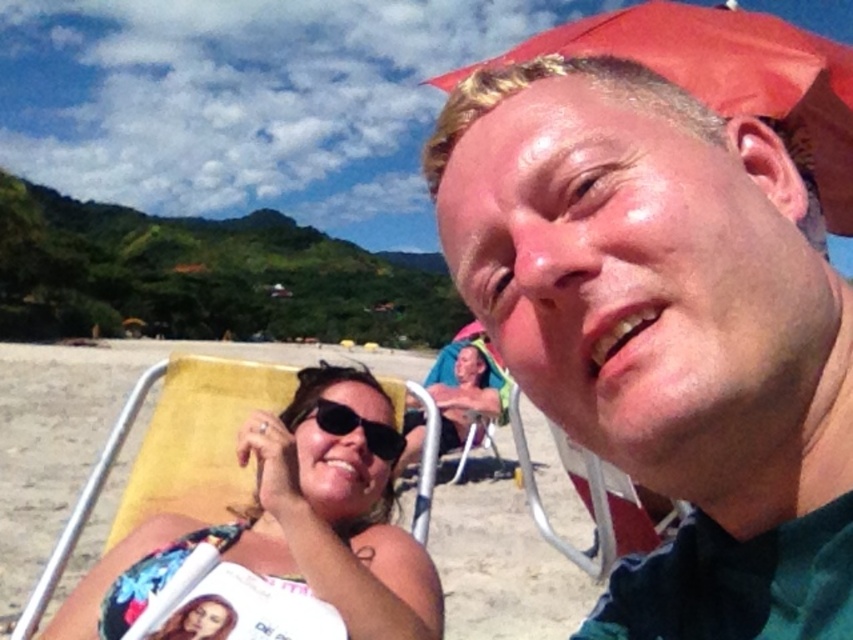
Is matte yellow towel at lower left smaller than black matte sunglasses at center?

No, matte yellow towel at lower left is not smaller than black matte sunglasses at center.

Can you confirm if matte yellow towel at lower left is positioned below black matte sunglasses at center?

Yes, matte yellow towel at lower left is below black matte sunglasses at center.

Is point (395, 536) positioned after point (346, 429)?

No, it is in front of (346, 429).

This screenshot has height=640, width=853. What are the coordinates of `matte yellow towel at lower left` in the screenshot? It's located at (335, 508).

This screenshot has width=853, height=640. I want to click on matte green shirt at center, so click(665, 330).

Which of these two, matte green shirt at center or matte yellow towel at lower left, stands taller?

Standing taller between the two is matte green shirt at center.

Who is more forward, (x=755, y=570) or (x=329, y=548)?

Point (x=755, y=570)

At what (x,y) coordinates should I click in order to perform the action: click on matte green shirt at center. Please return your answer as a coordinate pair (x, y). Looking at the image, I should click on (665, 330).

Can you confirm if matte black sunglasses at center is taller than black matte sunglasses at center?

Indeed, matte black sunglasses at center has a greater height compared to black matte sunglasses at center.

Can you confirm if matte black sunglasses at center is positioned to the left of black matte sunglasses at center?

In fact, matte black sunglasses at center is to the right of black matte sunglasses at center.

Between point (412, 417) and point (392, 461), which one is positioned in front?

Point (392, 461)

In order to click on matte black sunglasses at center in this screenshot , I will do `click(465, 396)`.